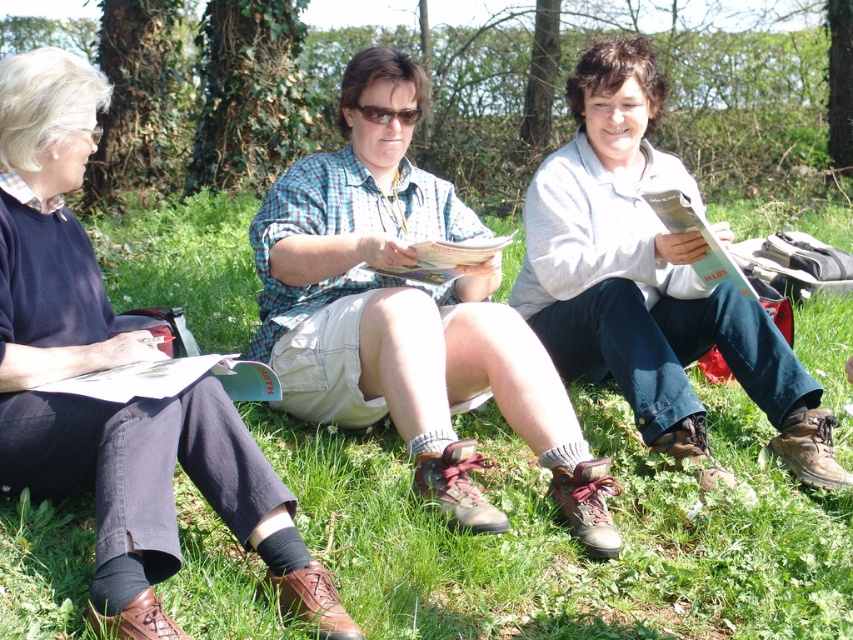
Does green grass at center have a larger size compared to light gray fleece jacket at center?

Actually, green grass at center might be smaller than light gray fleece jacket at center.

Is green grass at center to the left of light gray fleece jacket at center from the viewer's perspective?

Indeed, green grass at center is positioned on the left side of light gray fleece jacket at center.

At what (x,y) coordinates should I click in order to perform the action: click on green grass at center. Please return your answer as a coordinate pair (x, y). This screenshot has height=640, width=853. Looking at the image, I should click on (567, 534).

This screenshot has height=640, width=853. In order to click on green grass at center in this screenshot , I will do point(567,534).

Is checkered fabric shirt at center closer to the viewer compared to matte blue shirt at center?

No, checkered fabric shirt at center is behind matte blue shirt at center.

Which of these two, checkered fabric shirt at center or matte blue shirt at center, stands shorter?

matte blue shirt at center is shorter.

The width and height of the screenshot is (853, 640). Describe the element at coordinates (407, 312) in the screenshot. I see `checkered fabric shirt at center` at that location.

At what (x,y) coordinates should I click in order to perform the action: click on checkered fabric shirt at center. Please return your answer as a coordinate pair (x, y). Image resolution: width=853 pixels, height=640 pixels. Looking at the image, I should click on (407, 312).

How much distance is there between checkered fabric shirt at center and light gray fleece jacket at center?

A distance of 25.39 inches exists between checkered fabric shirt at center and light gray fleece jacket at center.

Does point (341, 96) come in front of point (590, 349)?

Yes, it is.

Where is `checkered fabric shirt at center`? This screenshot has width=853, height=640. checkered fabric shirt at center is located at coordinates (407, 312).